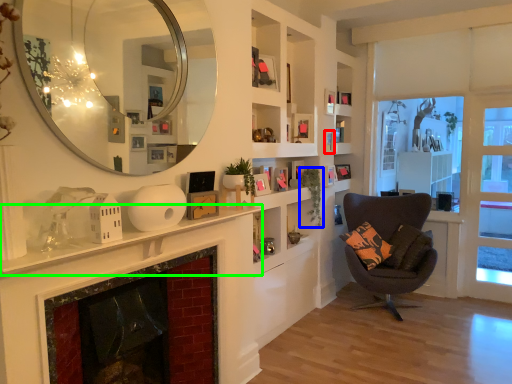
Question: Based on their relative distances, which object is farther from picture frame (highlighted by a red box)? Choose from plant (highlighted by a blue box) and mantle (highlighted by a green box).

Choices:
 (A) plant
 (B) mantle

Answer: (B)